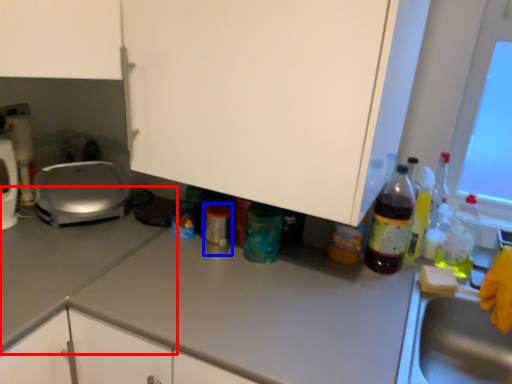
Question: Which point is closer to the camera, counter top (highlighted by a red box) or bottle (highlighted by a blue box)?

Choices:
 (A) counter top
 (B) bottle

Answer: (A)